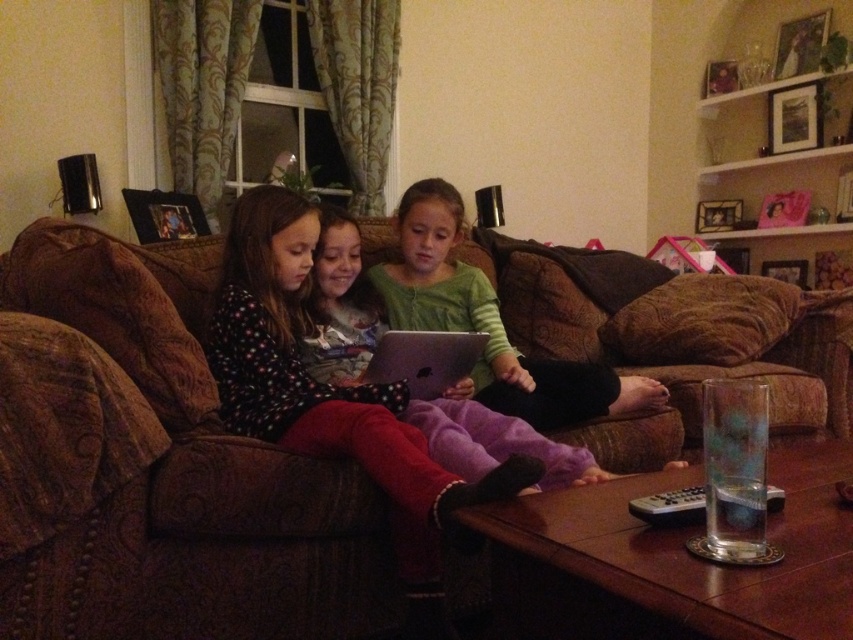
Question: Which object is farther from the camera taking this photo?

Choices:
 (A) green soft shirt at center
 (B) polka dot fleece at center
 (C) brown fabric couch at center

Answer: (C)

Question: Can you confirm if green soft shirt at center is smaller than silver metallic laptop at center?

Choices:
 (A) no
 (B) yes

Answer: (A)

Question: Can you confirm if brown fabric couch at center is positioned below silver metallic laptop at center?

Choices:
 (A) yes
 (B) no

Answer: (A)

Question: Which is farther from the brown fabric couch at center?

Choices:
 (A) green soft shirt at center
 (B) polka dot fleece at center
 (C) silver metallic laptop at center

Answer: (B)

Question: Which of the following is the farthest from the observer?

Choices:
 (A) (114, 240)
 (B) (415, 342)
 (C) (381, 452)

Answer: (A)

Question: Can you confirm if brown fabric couch at center is bigger than green soft shirt at center?

Choices:
 (A) yes
 (B) no

Answer: (A)